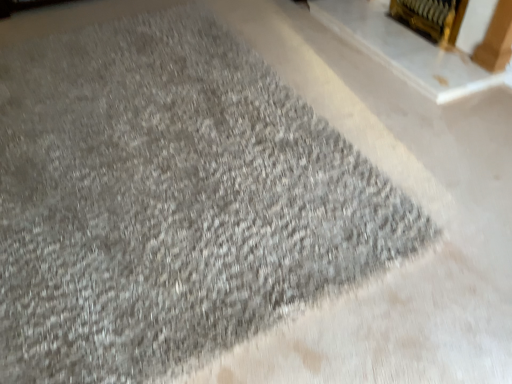
Question: Looking at the image, does gold metallic fireplace at upper right, which is the 2th fireplace in left-to-right order, seem bigger or smaller compared to gold metallic fireplace at upper right, which appears as the first fireplace when viewed from the left?

Choices:
 (A) small
 (B) big

Answer: (B)

Question: From the image's perspective, is gold metallic fireplace at upper right, which is the 2th fireplace in left-to-right order, above or below gold metallic fireplace at upper right, positioned as the second fireplace in right-to-left order?

Choices:
 (A) above
 (B) below

Answer: (A)

Question: Is gold metallic fireplace at upper right, which is the 2th fireplace in left-to-right order, wider or thinner than gold metallic fireplace at upper right, which appears as the first fireplace when viewed from the left?

Choices:
 (A) wide
 (B) thin

Answer: (B)

Question: Looking at the image, does gold metallic fireplace at upper right, positioned as the second fireplace in right-to-left order, seem bigger or smaller compared to gold metallic fireplace at upper right, which is the 2th fireplace in left-to-right order?

Choices:
 (A) small
 (B) big

Answer: (A)

Question: In terms of height, does gold metallic fireplace at upper right, which appears as the first fireplace when viewed from the left, look taller or shorter compared to gold metallic fireplace at upper right, acting as the first fireplace starting from the right?

Choices:
 (A) short
 (B) tall

Answer: (A)

Question: From the image's perspective, relative to gold metallic fireplace at upper right, acting as the first fireplace starting from the right, is gold metallic fireplace at upper right, positioned as the second fireplace in right-to-left order, above or below?

Choices:
 (A) above
 (B) below

Answer: (B)

Question: Is gold metallic fireplace at upper right, positioned as the second fireplace in right-to-left order, inside or outside of gold metallic fireplace at upper right, acting as the first fireplace starting from the right?

Choices:
 (A) inside
 (B) outside

Answer: (B)